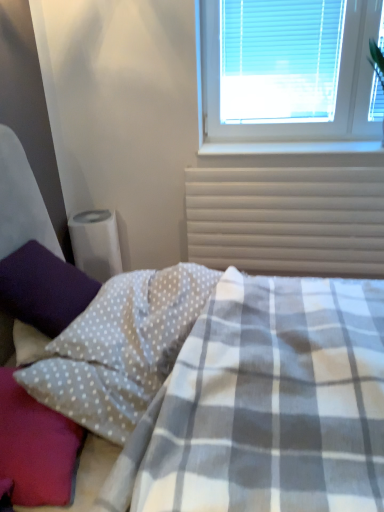
The width and height of the screenshot is (384, 512). What do you see at coordinates (290, 147) in the screenshot?
I see `white smooth window sill at lower center` at bounding box center [290, 147].

At what (x,y) coordinates should I click in order to perform the action: click on white dotted fabric pillow at lower left, the second pillow positioned from the left. Please return your answer as a coordinate pair (x, y). Looking at the image, I should click on (36, 447).

Measure the distance between point (217,215) and camera.

Point (217,215) is 2.32 meters from camera.

The height and width of the screenshot is (512, 384). Identify the location of white plastic blinds at upper right. (286, 70).

Can you confirm if white dotted fabric pillow at lower left, the second pillow positioned from the left, is positioned to the right of white smooth window sill at lower center?

In fact, white dotted fabric pillow at lower left, the second pillow positioned from the left, is to the left of white smooth window sill at lower center.

Which object is further away from the camera, white dotted fabric pillow at lower left, acting as the second pillow starting from the right, or white smooth window sill at lower center?

white smooth window sill at lower center is more distant.

Is point (5, 403) closer or farther from the camera than point (304, 150)?

Point (5, 403) appears to be closer to the viewer than point (304, 150).

Which point is more forward, [7,311] or [232,186]?

Positioned in front is point [7,311].

Between purple fuzzy pillow at left, the third pillow when ordered from right to left, and white plastic radiator at upper right, which one has more height?

Standing taller between the two is white plastic radiator at upper right.

Would you say purple fuzzy pillow at left, which is the first pillow from left to right, is to the left or to the right of white plastic radiator at upper right in the picture?

purple fuzzy pillow at left, which is the first pillow from left to right, is positioned on white plastic radiator at upper right's left side.

Considering the relative sizes of purple fuzzy pillow at left, the third pillow when ordered from right to left, and white plastic radiator at upper right in the image provided, is purple fuzzy pillow at left, the third pillow when ordered from right to left, wider than white plastic radiator at upper right?

Yes, purple fuzzy pillow at left, the third pillow when ordered from right to left, is wider than white plastic radiator at upper right.

Is white dotted fabric pillow at lower left, the first pillow positioned from the right, not near white plastic radiator at upper right?

That's right, there is a large distance between white dotted fabric pillow at lower left, the first pillow positioned from the right, and white plastic radiator at upper right.

Considering the relative sizes of white dotted fabric pillow at lower left, the first pillow positioned from the right, and white plastic radiator at upper right in the image provided, is white dotted fabric pillow at lower left, the first pillow positioned from the right, smaller than white plastic radiator at upper right?

Incorrect, white dotted fabric pillow at lower left, the first pillow positioned from the right, is not smaller in size than white plastic radiator at upper right.

Locate an element on the screen. The image size is (384, 512). radiator located on the right of white dotted fabric pillow at lower left, the first pillow positioned from the right is located at coordinates (287, 219).

From a real-world perspective, between white dotted fabric pillow at lower left, which ranks as the third pillow in left-to-right order, and white plastic radiator at upper right, who is vertically lower?

white plastic radiator at upper right.

Which of these two, white smooth window sill at lower center or white dotted fabric pillow at lower left, acting as the second pillow starting from the right, stands taller?

white dotted fabric pillow at lower left, acting as the second pillow starting from the right, is taller.

Between point (246, 148) and point (1, 462), which one is positioned in front?

Point (1, 462)

Is white smooth window sill at lower center oriented towards white dotted fabric pillow at lower left, acting as the second pillow starting from the right?

No, white smooth window sill at lower center is not oriented towards white dotted fabric pillow at lower left, acting as the second pillow starting from the right.

Is white smooth window sill at lower center wider or thinner than white dotted fabric pillow at lower left, acting as the second pillow starting from the right?

In the image, white smooth window sill at lower center appears to be more narrow than white dotted fabric pillow at lower left, acting as the second pillow starting from the right.

Does point (37, 316) come in front of point (276, 151)?

That is True.

Visually, is purple fuzzy pillow at left, the third pillow when ordered from right to left, positioned to the left or to the right of white smooth window sill at lower center?

purple fuzzy pillow at left, the third pillow when ordered from right to left, is positioned on white smooth window sill at lower center's left side.

From a real-world perspective, starting from the white smooth window sill at lower center, which pillow is the 1st one below it? Please provide its 2D coordinates.

[(43, 288)]

From a real-world perspective, relative to white smooth window sill at lower center, is purple fuzzy pillow at left, which is the first pillow from left to right, vertically above or below?

In terms of real-world spatial position, purple fuzzy pillow at left, which is the first pillow from left to right, is below white smooth window sill at lower center.

What's the angular difference between white plastic radiator at upper right and white dotted fabric pillow at lower left, the second pillow positioned from the left,'s facing directions?

The angle between the facing direction of white plastic radiator at upper right and the facing direction of white dotted fabric pillow at lower left, the second pillow positioned from the left, is 91.9 degrees.

Does white plastic radiator at upper right touch white dotted fabric pillow at lower left, acting as the second pillow starting from the right?

white plastic radiator at upper right is not next to white dotted fabric pillow at lower left, acting as the second pillow starting from the right, and they're not touching.

Is white plastic radiator at upper right positioned with its back to white dotted fabric pillow at lower left, the second pillow positioned from the left?

No, white plastic radiator at upper right is not facing the opposite direction of white dotted fabric pillow at lower left, the second pillow positioned from the left.

Is white plastic blinds at upper right in front of or behind white plastic radiator at upper right in the image?

Clearly, white plastic blinds at upper right is in front of white plastic radiator at upper right.

From the image's perspective, is white plastic blinds at upper right above white plastic radiator at upper right?

Yes, from the image's perspective, white plastic blinds at upper right is over white plastic radiator at upper right.

In the scene shown: Is white plastic radiator at upper right at the back of white plastic blinds at upper right?

No.

Based on the photo, is white plastic blinds at upper right far away from white plastic radiator at upper right?

No, white plastic blinds at upper right is not far away from white plastic radiator at upper right.

Image resolution: width=384 pixels, height=512 pixels. In order to click on pillow that is the 3rd one below the white smooth window sill at lower center (from a real-world perspective) in this screenshot , I will do `click(36, 447)`.

Where is `the 3rd pillow counting from the left of the white plastic radiator at upper right`? the 3rd pillow counting from the left of the white plastic radiator at upper right is located at coordinates (43, 288).

Estimate the real-world distances between objects in this image. Which object is closer to white plastic radiator at upper right, white smooth window sill at lower center or white dotted fabric pillow at lower left, the first pillow positioned from the right?

Among the two, white smooth window sill at lower center is located nearer to white plastic radiator at upper right.

Which object lies nearer to the anchor point white plastic radiator at upper right, white dotted fabric pillow at lower left, the first pillow positioned from the right, or purple fuzzy pillow at left, the third pillow when ordered from right to left?

Based on the image, white dotted fabric pillow at lower left, the first pillow positioned from the right, appears to be nearer to white plastic radiator at upper right.

Estimate the real-world distances between objects in this image. Which object is closer to white dotted fabric pillow at lower left, acting as the second pillow starting from the right, white dotted fabric pillow at lower left, the first pillow positioned from the right, or white plastic blinds at upper right?

→ Based on the image, white dotted fabric pillow at lower left, the first pillow positioned from the right, appears to be nearer to white dotted fabric pillow at lower left, acting as the second pillow starting from the right.

From the image, which object appears to be farther from white dotted fabric pillow at lower left, the second pillow positioned from the left, white plastic radiator at upper right or purple fuzzy pillow at left, the third pillow when ordered from right to left?

Based on the image, white plastic radiator at upper right appears to be further to white dotted fabric pillow at lower left, the second pillow positioned from the left.

Based on their spatial positions, is white smooth window sill at lower center or white plastic radiator at upper right further from white dotted fabric pillow at lower left, the second pillow positioned from the left?

white smooth window sill at lower center is further to white dotted fabric pillow at lower left, the second pillow positioned from the left.

When comparing their distances from white smooth window sill at lower center, does white dotted fabric pillow at lower left, acting as the second pillow starting from the right, or white plastic radiator at upper right seem further?

The object further to white smooth window sill at lower center is white dotted fabric pillow at lower left, acting as the second pillow starting from the right.

When comparing their distances from purple fuzzy pillow at left, which is the first pillow from left to right, does white dotted fabric pillow at lower left, acting as the second pillow starting from the right, or white plastic blinds at upper right seem further?

white plastic blinds at upper right is further to purple fuzzy pillow at left, which is the first pillow from left to right.

Estimate the real-world distances between objects in this image. Which object is closer to white plastic radiator at upper right, purple fuzzy pillow at left, the third pillow when ordered from right to left, or white dotted fabric pillow at lower left, the first pillow positioned from the right?

The object closer to white plastic radiator at upper right is white dotted fabric pillow at lower left, the first pillow positioned from the right.

I want to click on window between purple fuzzy pillow at left, which is the first pillow from left to right, and white plastic radiator at upper right from left to right, so click(286, 70).

Locate an element on the screen. window between purple fuzzy pillow at left, which is the first pillow from left to right, and white smooth window sill at lower center, in the horizontal direction is located at coordinates (286, 70).

Image resolution: width=384 pixels, height=512 pixels. Find the location of `radiator between white plastic blinds at upper right and white dotted fabric pillow at lower left, the second pillow positioned from the left, in the up-down direction`. radiator between white plastic blinds at upper right and white dotted fabric pillow at lower left, the second pillow positioned from the left, in the up-down direction is located at coordinates (287, 219).

Locate an element on the screen. Image resolution: width=384 pixels, height=512 pixels. pillow between white plastic blinds at upper right and white dotted fabric pillow at lower left, which ranks as the third pillow in left-to-right order, from top to bottom is located at coordinates (43, 288).